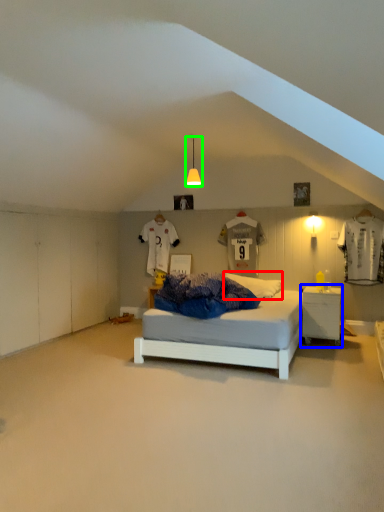
Question: Based on their relative distances, which object is farther from pillow (highlighted by a red box)? Choose from nightstand (highlighted by a blue box) and light fixture (highlighted by a green box).

Choices:
 (A) nightstand
 (B) light fixture

Answer: (B)